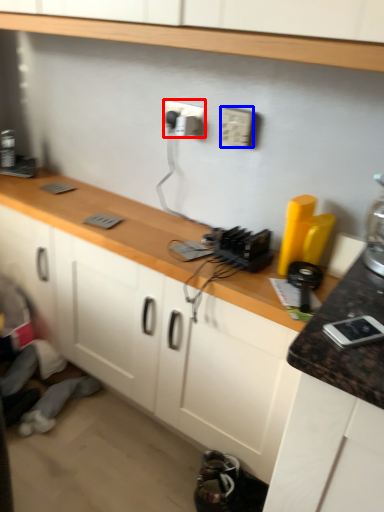
Question: Which object appears closest to the camera in this image, electric outlet (highlighted by a red box) or electric outlet (highlighted by a blue box)?

Choices:
 (A) electric outlet
 (B) electric outlet

Answer: (B)